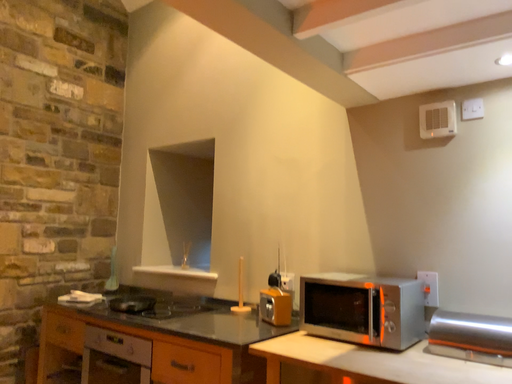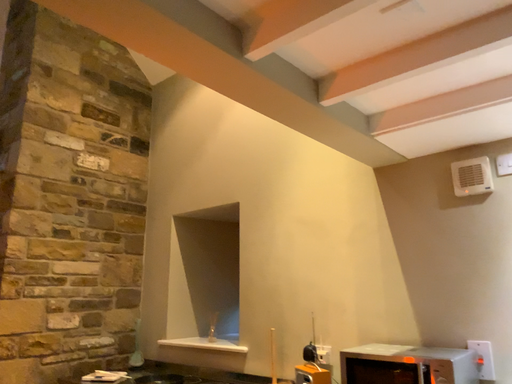
Question: How did the camera likely rotate when shooting the video?

Choices:
 (A) rotated downward
 (B) rotated upward

Answer: (B)